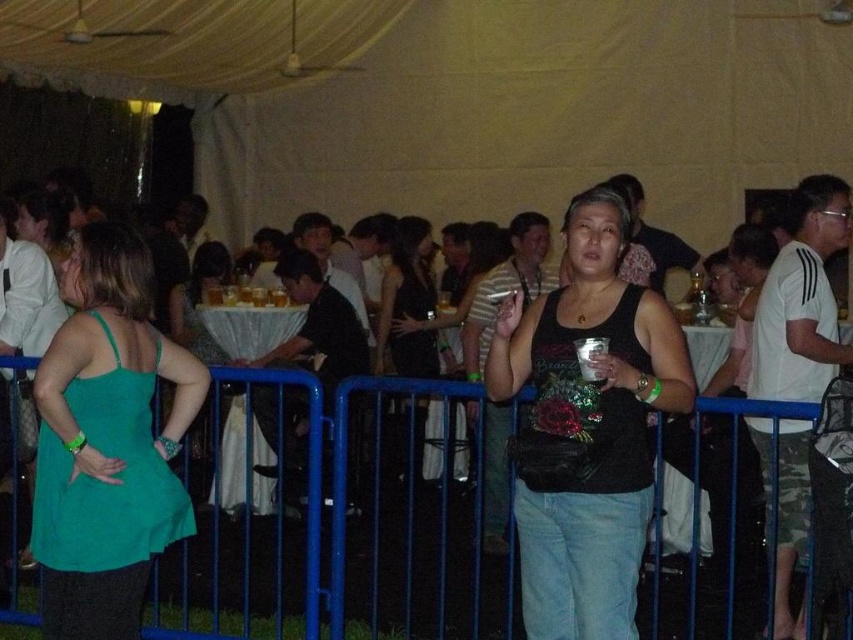
Is black matte tank top at center above black satin dress at center?

No, black matte tank top at center is not above black satin dress at center.

Between black matte tank top at center and black satin dress at center, which one is positioned higher?

black satin dress at center

At what (x,y) coordinates should I click in order to perform the action: click on black matte tank top at center. Please return your answer as a coordinate pair (x, y). Looking at the image, I should click on (585, 428).

Between blue metal fence at center and black satin dress at center, which one appears on the left side from the viewer's perspective?

Positioned to the left is blue metal fence at center.

The height and width of the screenshot is (640, 853). Find the location of `blue metal fence at center`. blue metal fence at center is located at coordinates (357, 557).

The image size is (853, 640). In order to click on blue metal fence at center in this screenshot , I will do `click(357, 557)`.

Does black matte tank top at center have a larger size compared to green fabric dress at center?

Actually, black matte tank top at center might be smaller than green fabric dress at center.

Image resolution: width=853 pixels, height=640 pixels. I want to click on black matte tank top at center, so click(585, 428).